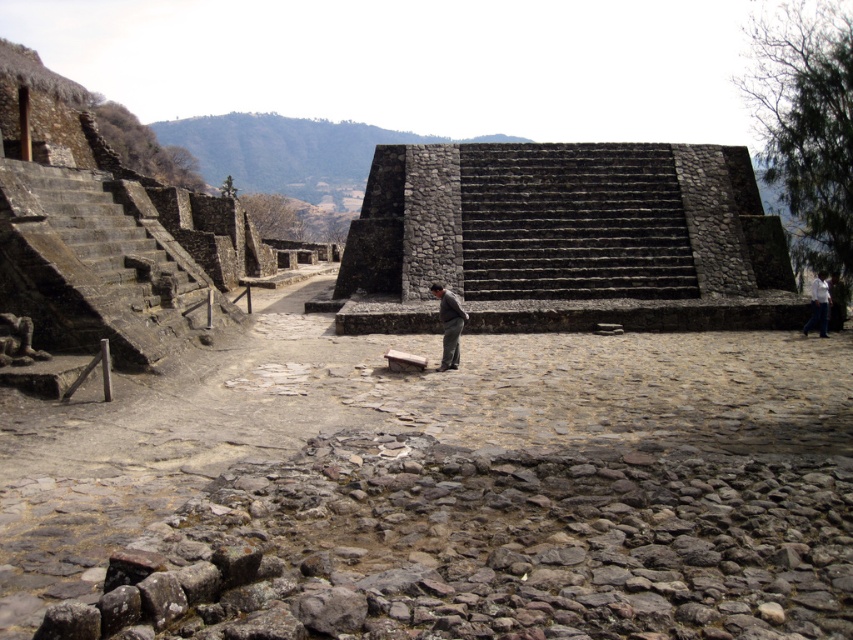
Question: Based on their relative distances, which object is nearer to the dark gray stone pyramid at center?

Choices:
 (A) dark gray stone figure at center
 (B) white cotton shirt at center

Answer: (B)

Question: Considering the real-world distances, which object is farthest from the dark gray stone figure at center?

Choices:
 (A) white cotton shirt at center
 (B) dark gray stone pyramid at center

Answer: (B)

Question: Can you confirm if dark gray stone pyramid at center is positioned to the right of dark gray stone figure at center?

Choices:
 (A) no
 (B) yes

Answer: (B)

Question: Is dark gray stone figure at center positioned before white cotton shirt at center?

Choices:
 (A) no
 (B) yes

Answer: (B)

Question: Observing the image, what is the correct spatial positioning of dark gray stone pyramid at center in reference to white cotton shirt at center?

Choices:
 (A) above
 (B) below

Answer: (A)

Question: Which of the following is the closest to the observer?

Choices:
 (A) dark gray stone pyramid at center
 (B) white cotton shirt at center

Answer: (B)